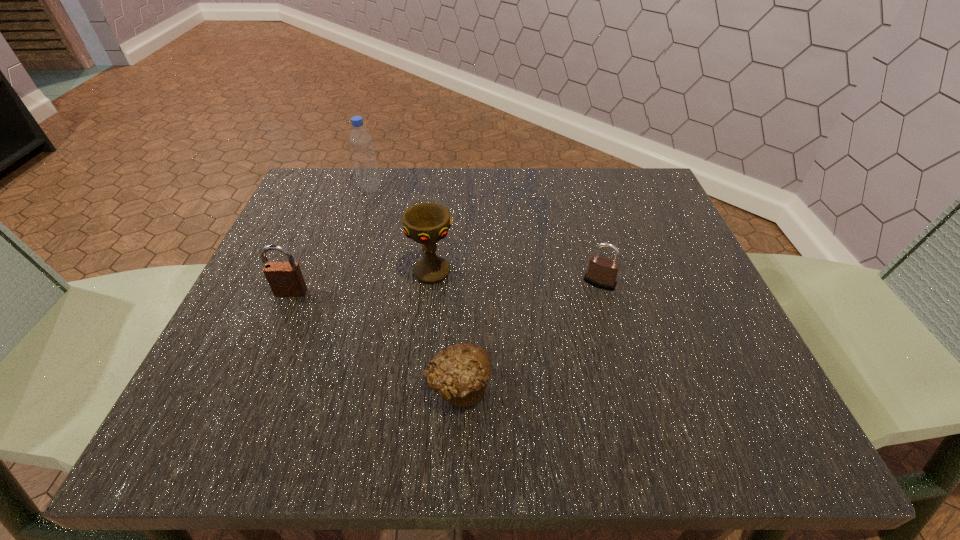
Find the location of a particular element. empty location between the chalice and the shortest object is located at coordinates (444, 329).

Image resolution: width=960 pixels, height=540 pixels. I want to click on unoccupied area between the second tallest object and the left padlock, so click(x=361, y=282).

Locate an element on the screen. blank region between the chalice and the muffin is located at coordinates (444, 329).

Where is `the closest object to the left padlock`? the closest object to the left padlock is located at coordinates (427, 223).

Point out which object is positioned as the fourth nearest to the shorter padlock. Please provide its 2D coordinates. Your answer should be formatted as a tuple, i.e. [(x, y)], where the tuple contains the x and y coordinates of a point satisfying the conditions above.

[(285, 279)]

The width and height of the screenshot is (960, 540). Identify the location of vacant area in the image that satisfies the following two spatial constraints: 1. on the front side of the fourth tallest object; 2. on the right side of the chalice. pos(430,283).

Identify the location of vacant position in the image that satisfies the following two spatial constraints: 1. on the front side of the fourth shortest object; 2. on the left side of the fourth object from right to left. (343, 272).

Identify the location of free space that satisfies the following two spatial constraints: 1. on the front-facing side of the muffin; 2. on the left side of the leftmost object. (251, 386).